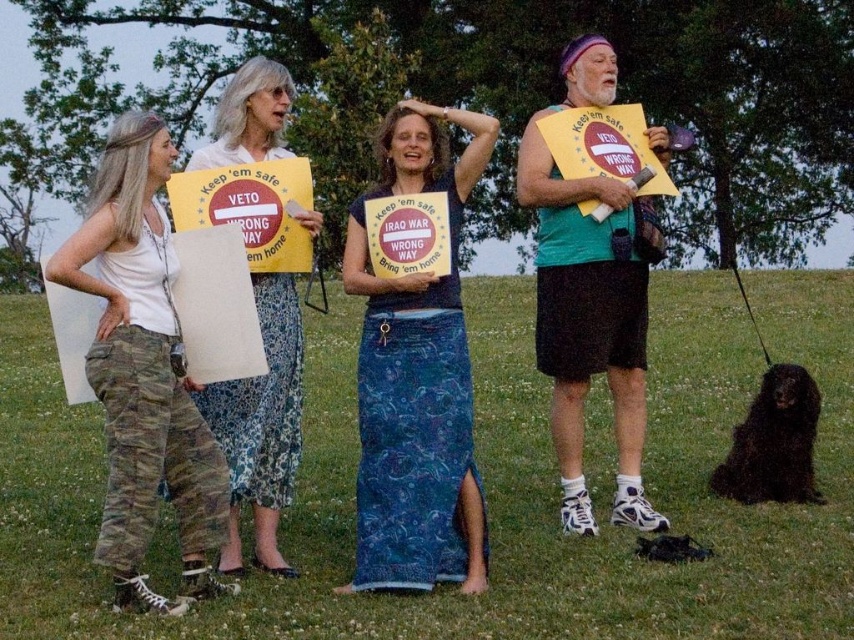
Question: Based on their relative distances, which object is farther from the black silky fur at lower right?

Choices:
 (A) blue denim skirt at center
 (B) camouflage pants at left

Answer: (B)

Question: Does blue denim skirt at center have a lesser width compared to floral skirt at center?

Choices:
 (A) no
 (B) yes

Answer: (A)

Question: Can you confirm if blue denim skirt at center is positioned to the right of floral skirt at center?

Choices:
 (A) yes
 (B) no

Answer: (A)

Question: Among these objects, which one is nearest to the camera?

Choices:
 (A) black silky fur at lower right
 (B) blue denim skirt at center
 (C) camouflage pants at left
 (D) floral skirt at center

Answer: (C)

Question: Which of the following is the farthest from the observer?

Choices:
 (A) camouflage pants at left
 (B) blue denim skirt at center
 (C) floral skirt at center

Answer: (C)

Question: Does blue denim skirt at center have a larger size compared to camouflage pants at left?

Choices:
 (A) yes
 (B) no

Answer: (A)